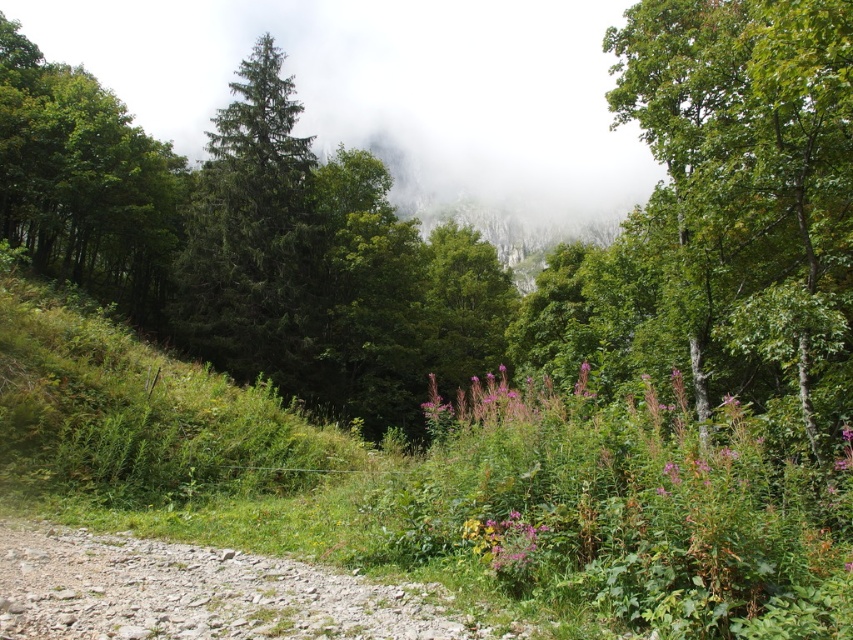
Does green matte tree at left have a smaller size compared to purple soft flower at center?

Incorrect, green matte tree at left is not smaller in size than purple soft flower at center.

Which is behind, point (103, 230) or point (496, 376)?

Point (496, 376)

Who is more distant from viewer, (x=33, y=205) or (x=445, y=412)?

Point (x=33, y=205)

At what (x,y) coordinates should I click in order to perform the action: click on green matte tree at left. Please return your answer as a coordinate pair (x, y). The image size is (853, 640). Looking at the image, I should click on (85, 180).

Based on the photo, which is above, green matte evergreen tree at center or purple soft flower at center?

Positioned higher is green matte evergreen tree at center.

Describe the element at coordinates (253, 236) in the screenshot. This screenshot has width=853, height=640. I see `green matte evergreen tree at center` at that location.

Between point (296, 186) and point (509, 413), which one is positioned in front?

Positioned in front is point (509, 413).

This screenshot has width=853, height=640. I want to click on green matte evergreen tree at center, so click(x=253, y=236).

Measure the distance between green matte tree at left and camera.

green matte tree at left is 79.98 feet away from camera.

I want to click on green matte tree at left, so [x=85, y=180].

This screenshot has height=640, width=853. What do you see at coordinates (85, 180) in the screenshot? I see `green matte tree at left` at bounding box center [85, 180].

At what (x,y) coordinates should I click in order to perform the action: click on green matte tree at left. Please return your answer as a coordinate pair (x, y). This screenshot has height=640, width=853. Looking at the image, I should click on (85, 180).